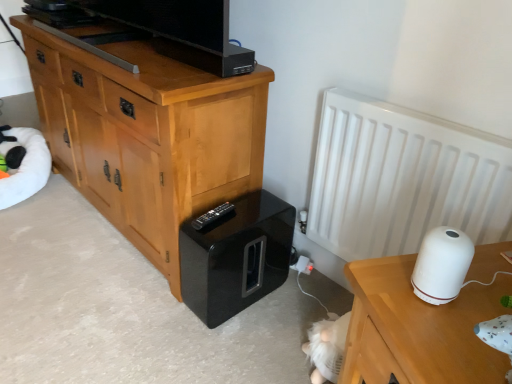
You are a GUI agent. You are given a task and a screenshot of the screen. Output one action in this format:
    pyautogui.click(x=<x>, y=<y>)
    Task: Click on the empty space that is in between light brown wood chest of drawers at left and white plush bean bag at left
    The width and height of the screenshot is (512, 384).
    Given the screenshot: What is the action you would take?
    coord(68,238)